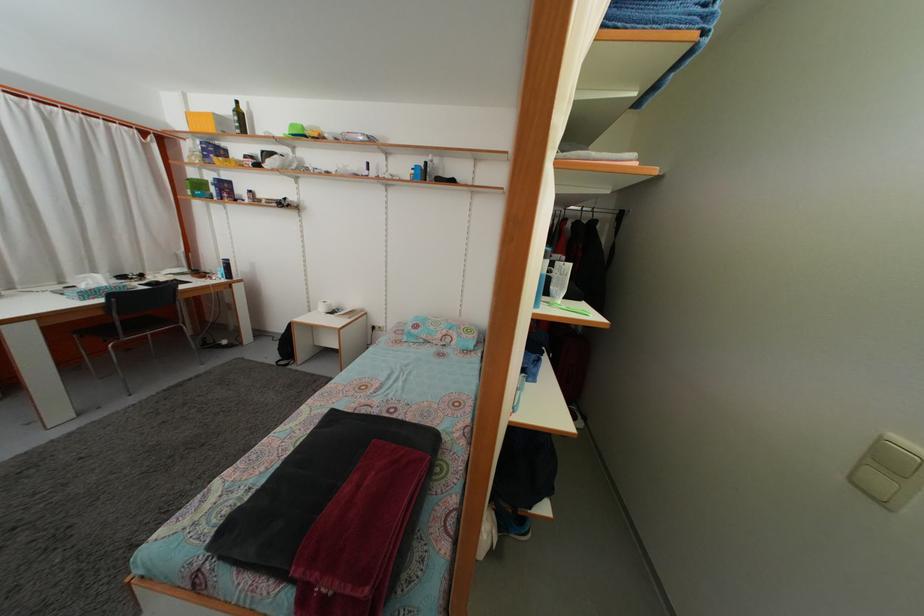
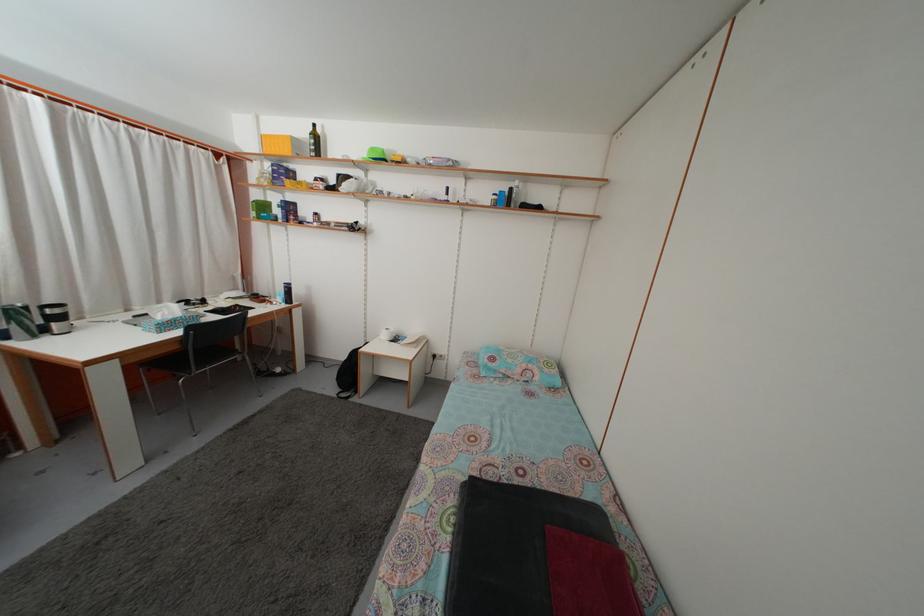
Question: The first image is from the beginning of the video and the second image is from the end. How did the camera likely rotate when shooting the video?

Choices:
 (A) Left
 (B) Right
 (C) Up
 (D) Down

Answer: (C)